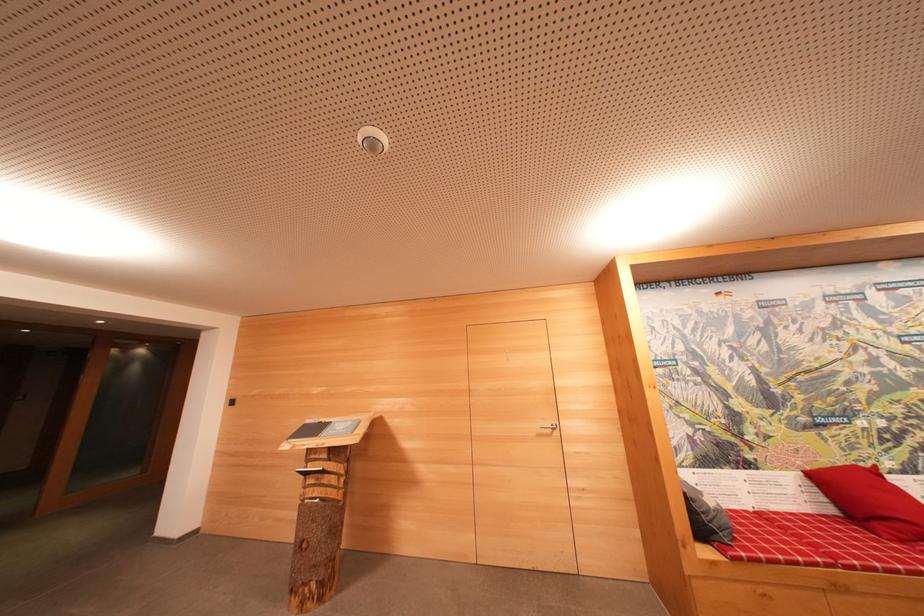
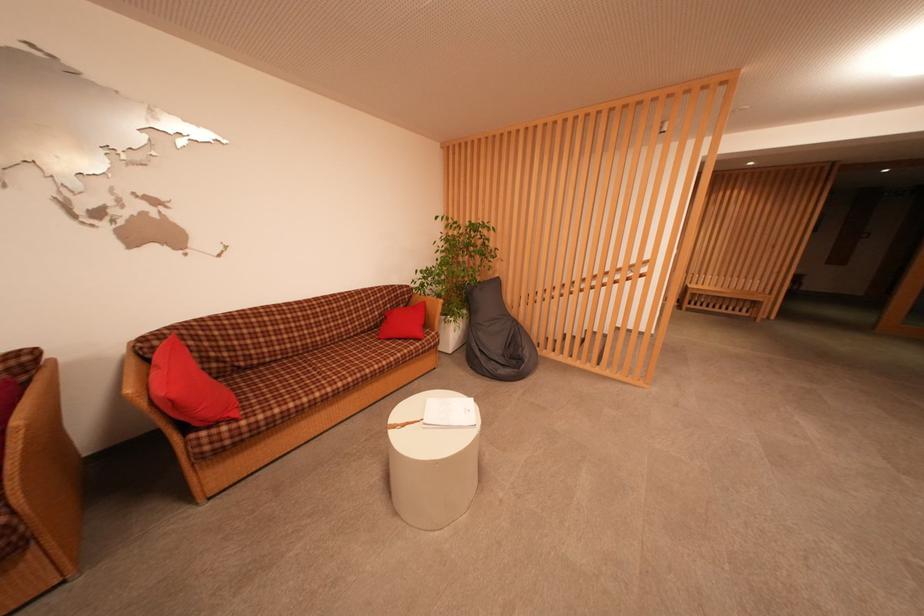
Question: The camera is either moving clockwise (left) or counter-clockwise (right) around the object. The first image is from the beginning of the video and the second image is from the end. Is the camera moving left or right when shooting the video?

Choices:
 (A) Left
 (B) Right

Answer: (B)